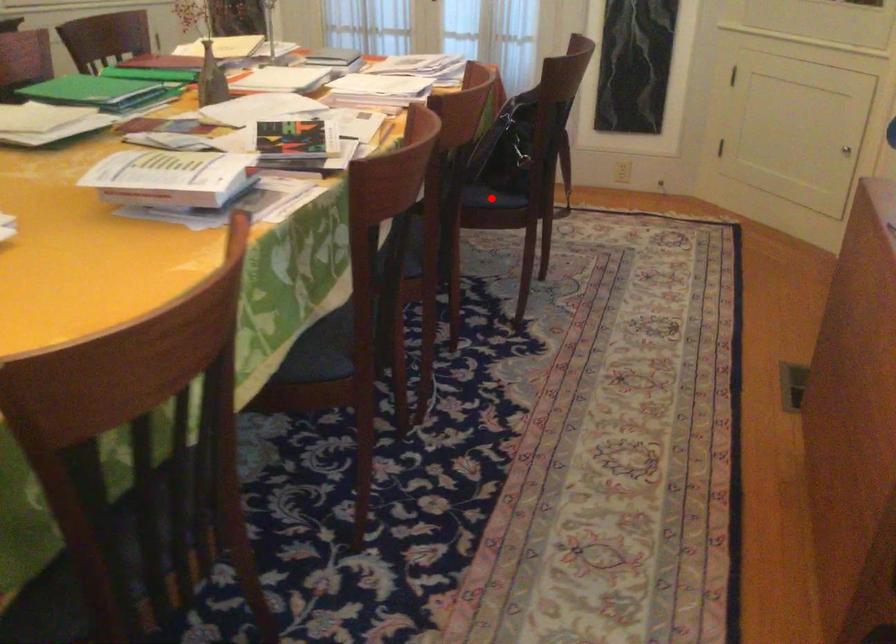
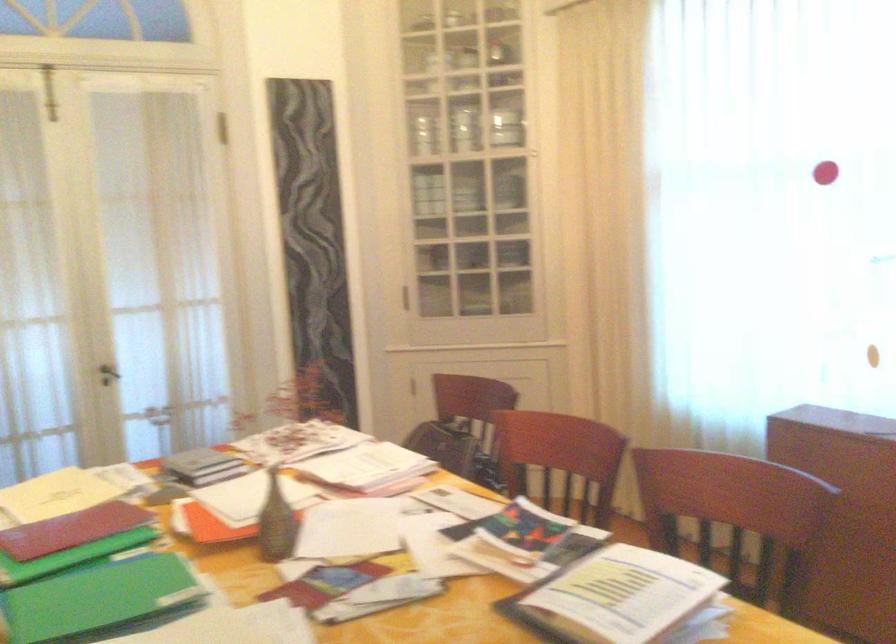
Question: I am providing you with two images of the same scene from different viewpoints. A red point is marked on the first image. Is the red point's position out of view in image 2?

Choices:
 (A) Yes
 (B) No

Answer: (A)